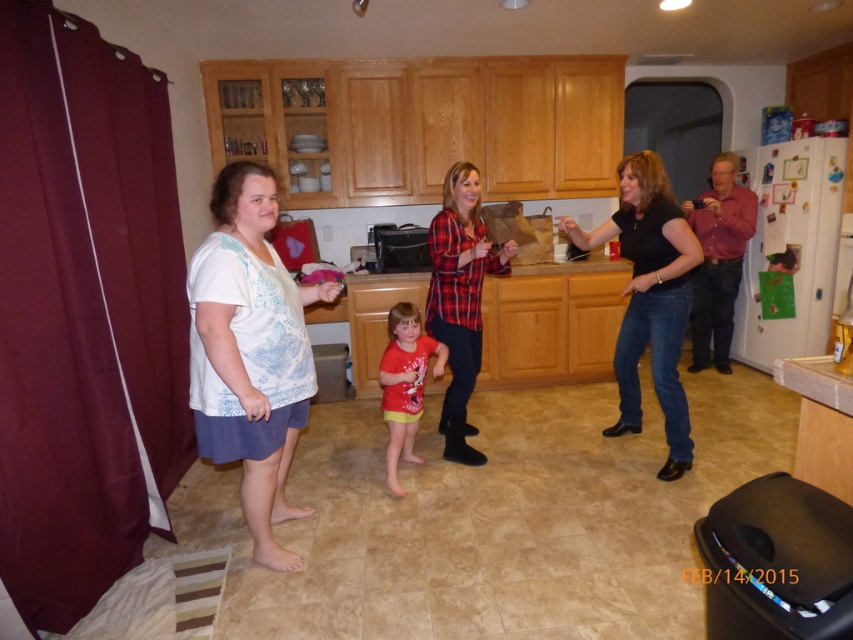
You are standing in the kitchen and want to hand a recipe card to the person wearing the white cotton shirt at left. Based on their position, where should you approach them from?

The white cotton shirt at left is positioned at point 0.473 on the x axis and 0.743 on the y axis, so you should approach them from the right side since their left side is occupied by the kitchen counter.

You are standing in the kitchen scene described. A point of interest is located at coordinates point (213, 321). If you want to reach this point quickly, would you need to move closer to it or are you already at the optimal distance?

The distance of point (213, 321) from the camera is 6.58 feet, so you are already at the optimal distance and do not need to move closer.